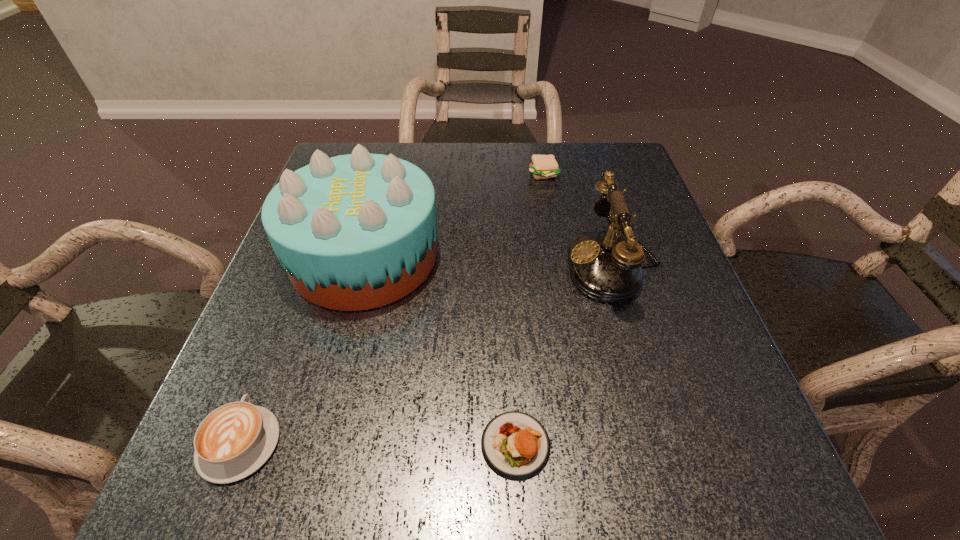
Where is `free space between the shorter patty (food) and the cappuccino`? This screenshot has width=960, height=540. free space between the shorter patty (food) and the cappuccino is located at coordinates [377, 443].

Find the location of `unoccupied position between the telephone and the taller patty (food)`. unoccupied position between the telephone and the taller patty (food) is located at coordinates (578, 219).

At what (x,y) coordinates should I click in order to perform the action: click on empty location between the third object from left to right and the telephone. Please return your answer as a coordinate pair (x, y). This screenshot has width=960, height=540. Looking at the image, I should click on (564, 354).

Find the location of a particular element. The width and height of the screenshot is (960, 540). vacant area that lies between the cappuccino and the tallest object is located at coordinates (302, 349).

This screenshot has height=540, width=960. Find the location of `free spot between the telephone and the right patty (food)`. free spot between the telephone and the right patty (food) is located at coordinates (578, 219).

You are a GUI agent. You are given a task and a screenshot of the screen. Output one action in this format:
    pyautogui.click(x=<x>, y=<y>)
    Task: Click on the vacant area that lies between the cappuccino and the third object from left to right
    The image size is (960, 540).
    Given the screenshot: What is the action you would take?
    pyautogui.click(x=377, y=443)

Locate an element on the screen. Image resolution: width=960 pixels, height=540 pixels. vacant area that lies between the cake and the left patty (food) is located at coordinates (440, 350).

I want to click on blank region between the shortest object and the tallest object, so click(440, 350).

Find the location of a particular element. object that is the closest to the cappuccino is located at coordinates (354, 232).

Identify the location of object that ranks as the second closest to the telephone. (515, 445).